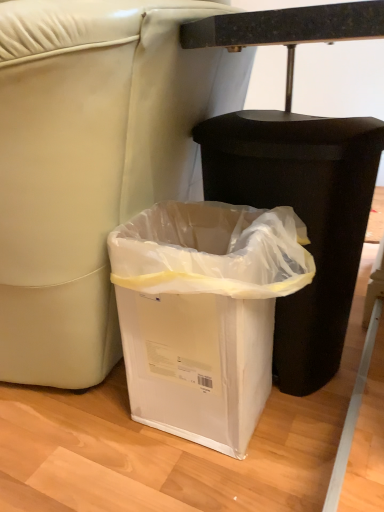
Question: Which direction should I rotate to face white plastic waste container at lower center, positioned as the first waste container in left-to-right order, — up or down?

Choices:
 (A) up
 (B) down

Answer: (B)

Question: Considering the relative sizes of black plastic waste container at lower center, which ranks as the first waste container in right-to-left order, and white plastic waste container at lower center, which ranks as the second waste container in right-to-left order, in the image provided, is black plastic waste container at lower center, which ranks as the first waste container in right-to-left order, bigger than white plastic waste container at lower center, which ranks as the second waste container in right-to-left order,?

Choices:
 (A) yes
 (B) no

Answer: (A)

Question: From a real-world perspective, is black plastic waste container at lower center, which appears as the 2th waste container when viewed from the left, located higher than white plastic waste container at lower center, positioned as the first waste container in left-to-right order?

Choices:
 (A) yes
 (B) no

Answer: (A)

Question: From a real-world perspective, is black plastic waste container at lower center, which appears as the 2th waste container when viewed from the left, located beneath white plastic waste container at lower center, positioned as the first waste container in left-to-right order?

Choices:
 (A) no
 (B) yes

Answer: (A)

Question: Is black plastic waste container at lower center, which ranks as the first waste container in right-to-left order, not within white plastic waste container at lower center, which ranks as the second waste container in right-to-left order?

Choices:
 (A) yes
 (B) no

Answer: (A)

Question: From the image's perspective, is black plastic waste container at lower center, which ranks as the first waste container in right-to-left order, over white plastic waste container at lower center, positioned as the first waste container in left-to-right order?

Choices:
 (A) yes
 (B) no

Answer: (A)

Question: Considering the relative positions of black plastic waste container at lower center, which appears as the 2th waste container when viewed from the left, and white plastic waste container at lower center, positioned as the first waste container in left-to-right order, in the image provided, is black plastic waste container at lower center, which appears as the 2th waste container when viewed from the left, to the left of white plastic waste container at lower center, positioned as the first waste container in left-to-right order, from the viewer's perspective?

Choices:
 (A) no
 (B) yes

Answer: (A)

Question: Is white plastic waste container at lower center, positioned as the first waste container in left-to-right order, closer to the viewer compared to black plastic waste container at lower center, which ranks as the first waste container in right-to-left order?

Choices:
 (A) no
 (B) yes

Answer: (B)

Question: Is white plastic waste container at lower center, which ranks as the second waste container in right-to-left order, facing away from black plastic waste container at lower center, which appears as the 2th waste container when viewed from the left?

Choices:
 (A) no
 (B) yes

Answer: (A)

Question: From a real-world perspective, is white plastic waste container at lower center, which ranks as the second waste container in right-to-left order, located beneath black plastic waste container at lower center, which ranks as the first waste container in right-to-left order?

Choices:
 (A) yes
 (B) no

Answer: (A)

Question: From the image's perspective, does white plastic waste container at lower center, positioned as the first waste container in left-to-right order, appear higher than black plastic waste container at lower center, which ranks as the first waste container in right-to-left order?

Choices:
 (A) yes
 (B) no

Answer: (B)

Question: Can you confirm if white plastic waste container at lower center, positioned as the first waste container in left-to-right order, is positioned to the right of black plastic waste container at lower center, which appears as the 2th waste container when viewed from the left?

Choices:
 (A) yes
 (B) no

Answer: (B)

Question: Does white plastic waste container at lower center, which ranks as the second waste container in right-to-left order, have a greater height compared to black plastic waste container at lower center, which ranks as the first waste container in right-to-left order?

Choices:
 (A) yes
 (B) no

Answer: (B)

Question: From the image's perspective, is black plastic waste container at lower center, which appears as the 2th waste container when viewed from the left, located above or below white plastic waste container at lower center, positioned as the first waste container in left-to-right order?

Choices:
 (A) below
 (B) above

Answer: (B)